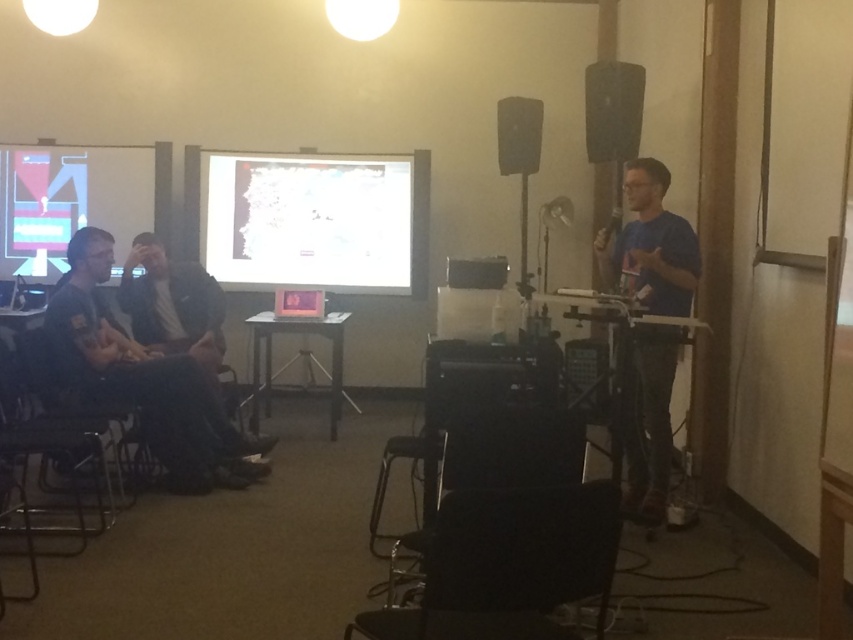
Does white matte projection screen at center have a greater width compared to matte plastic projection screen at upper left?

Correct, the width of white matte projection screen at center exceeds that of matte plastic projection screen at upper left.

Between point (276, 262) and point (50, 253), which one is positioned behind?

The point (276, 262) is behind.

Image resolution: width=853 pixels, height=640 pixels. What do you see at coordinates (318, 221) in the screenshot?
I see `white matte projection screen at center` at bounding box center [318, 221].

What are the coordinates of `white matte projection screen at center` in the screenshot? It's located at (318, 221).

Measure the distance from matte plastic projection screen at upper left to matte black speaker at upper center.

9.70 feet

Is point (22, 161) positioned before point (514, 99)?

That is False.

The width and height of the screenshot is (853, 640). I want to click on matte plastic projection screen at upper left, so click(x=68, y=202).

Between white matte projection screen at center and black matte speaker at upper right, which one appears on the left side from the viewer's perspective?

white matte projection screen at center

Describe the element at coordinates (318, 221) in the screenshot. I see `white matte projection screen at center` at that location.

Identify the location of white matte projection screen at center. This screenshot has height=640, width=853. (318, 221).